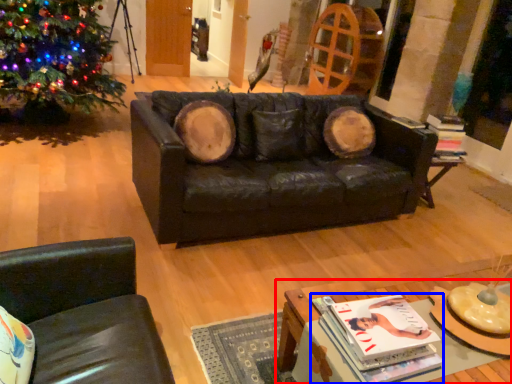
Question: Among these objects, which one is nearest to the camera, table (highlighted by a red box) or magazine (highlighted by a blue box)?

Choices:
 (A) table
 (B) magazine

Answer: (A)